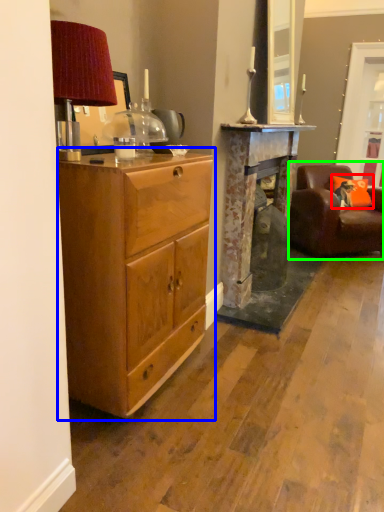
Question: Based on their relative distances, which object is farther from pillow (highlighted by a red box)? Choose from cabinetry (highlighted by a blue box) and chair (highlighted by a green box).

Choices:
 (A) cabinetry
 (B) chair

Answer: (A)